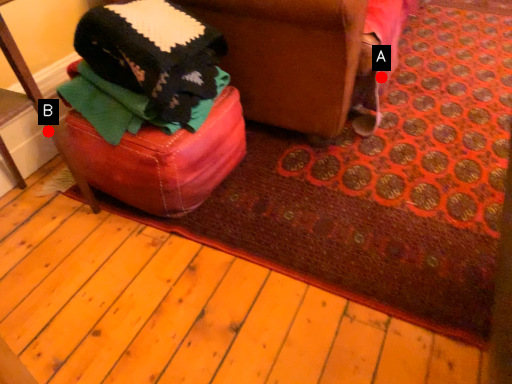
Question: Two points are circled on the image, labeled by A and B beside each circle. Which of the following is the closest to the observer?

Choices:
 (A) A is closer
 (B) B is closer

Answer: (B)